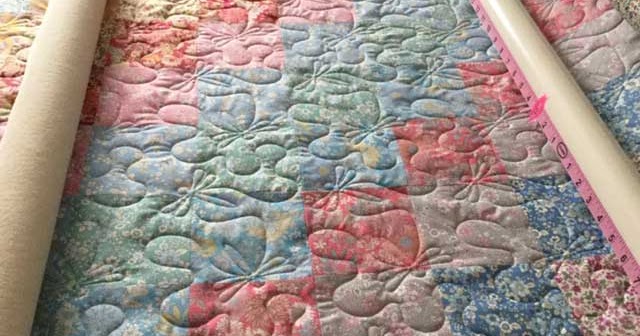
The image size is (640, 336). In order to click on quilt in this screenshot , I will do `click(282, 161)`.